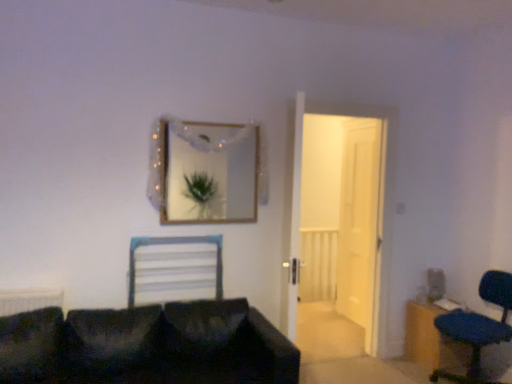
This screenshot has height=384, width=512. I want to click on vacant space situated above gold-framed mirror at upper center (from a real-world perspective), so click(x=206, y=114).